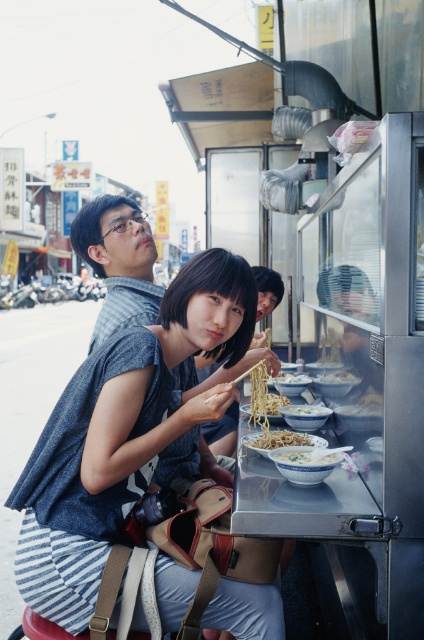
Can you confirm if matte blue shirt at upper left is wider than yellow noodle at center?

Yes, matte blue shirt at upper left is wider than yellow noodle at center.

Does point (206, 454) come farther from viewer compared to point (267, 413)?

No, (206, 454) is in front of (267, 413).

Where is `matte blue shirt at upper left`? This screenshot has height=640, width=424. matte blue shirt at upper left is located at coordinates (119, 262).

From the picture: Does matte blue shirt at upper left come behind white glossy bowl at center?

Yes.

Can you confirm if matte blue shirt at upper left is positioned below white glossy bowl at center?

Actually, matte blue shirt at upper left is above white glossy bowl at center.

Does point (108, 257) come closer to viewer compared to point (253, 403)?

No, it is not.

What are the coordinates of `matte blue shirt at upper left` in the screenshot? It's located at (119, 262).

What do you see at coordinates (306, 456) in the screenshot?
I see `white matte bowl at center` at bounding box center [306, 456].

Which is below, white matte bowl at center or white matte noodles at center?

white matte bowl at center is below.

Find the location of a particular element. white matte bowl at center is located at coordinates (306, 456).